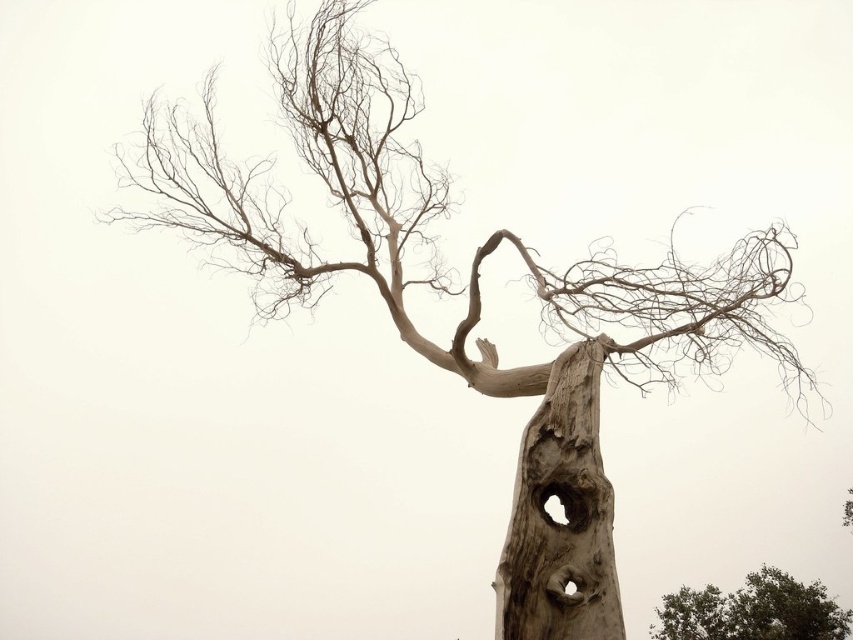
Does gray rough bark tree trunk at center have a greater width compared to green leafy tree at lower right?

In fact, gray rough bark tree trunk at center might be narrower than green leafy tree at lower right.

Can you confirm if gray rough bark tree trunk at center is bigger than green leafy tree at lower right?

Yes, gray rough bark tree trunk at center is bigger than green leafy tree at lower right.

Is point (569, 454) positioned after point (831, 628)?

No, it is in front of (831, 628).

What are the coordinates of `gray rough bark tree trunk at center` in the screenshot? It's located at (563, 516).